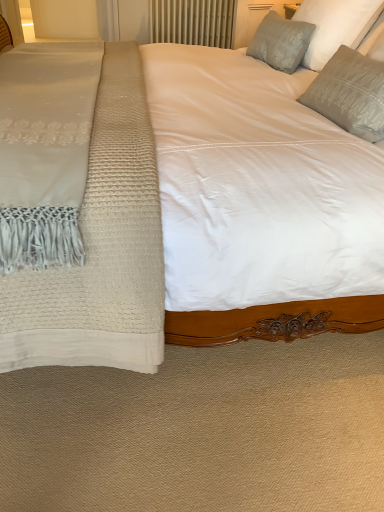
Identify the location of gray textured pillow at upper right, the second pillow from the front. (x=333, y=26).

Find the location of a particular element. The width and height of the screenshot is (384, 512). satin gray pillow at upper right, the first pillow viewed from the front is located at coordinates (350, 94).

Describe the element at coordinates (193, 22) in the screenshot. I see `metallic radiator at upper center` at that location.

Image resolution: width=384 pixels, height=512 pixels. What do you see at coordinates (65, 19) in the screenshot? I see `transparent glass door at upper left` at bounding box center [65, 19].

Where is `gray textured pillow at upper right, the second pillow from the front`? gray textured pillow at upper right, the second pillow from the front is located at coordinates (333, 26).

Does satin gray pillow at upper right, the first pillow viewed from the front, lie behind metallic radiator at upper center?

No, it is not.

Looking at this image, from a real-world perspective, is satin gray pillow at upper right, the first pillow viewed from the front, positioned over metallic radiator at upper center based on gravity?

Yes, from a real-world perspective, satin gray pillow at upper right, the first pillow viewed from the front, is over metallic radiator at upper center

Do you think satin gray pillow at upper right, the first pillow viewed from the front, is within metallic radiator at upper center, or outside of it?

satin gray pillow at upper right, the first pillow viewed from the front, exists outside the volume of metallic radiator at upper center.

What's the angular difference between satin gray pillow at upper right, acting as the 3th pillow starting from the back, and metallic radiator at upper center's facing directions?

The angular difference between satin gray pillow at upper right, acting as the 3th pillow starting from the back, and metallic radiator at upper center is 86.5 degrees.

Is satin gray pillow at upper right, the first pillow viewed from the front, at the right side of gray textured pillow at upper right, positioned as the 2th pillow in back-to-front order?

No.

Is satin gray pillow at upper right, the first pillow viewed from the front, looking in the opposite direction of gray textured pillow at upper right, the second pillow from the front?

Absolutely, satin gray pillow at upper right, the first pillow viewed from the front, is directed away from gray textured pillow at upper right, the second pillow from the front.

Based on the photo, is satin gray pillow at upper right, acting as the 3th pillow starting from the back, touching gray textured pillow at upper right, positioned as the 2th pillow in back-to-front order?

No.

Looking at their sizes, would you say satin gray pillow at upper right, the first pillow viewed from the front, is wider or thinner than gray textured pillow at upper right, the second pillow from the front?

satin gray pillow at upper right, the first pillow viewed from the front, is thinner than gray textured pillow at upper right, the second pillow from the front.

How far apart are metallic radiator at upper center and transparent glass door at upper left?

metallic radiator at upper center is 1.70 meters from transparent glass door at upper left.

Considering the sizes of metallic radiator at upper center and transparent glass door at upper left in the image, is metallic radiator at upper center wider or thinner than transparent glass door at upper left?

Considering their sizes, metallic radiator at upper center looks slimmer than transparent glass door at upper left.

Is the depth of metallic radiator at upper center greater than that of transparent glass door at upper left?

No, metallic radiator at upper center is closer to the viewer.

From a real-world perspective, which object rests below the other?

From a 3D spatial view, transparent glass door at upper left is below.

Does point (300, 41) lie behind point (366, 139)?

Yes, point (300, 41) is farther from viewer.

Considering the relative sizes of satin gray pillow at upper right, the 1th pillow when ordered from back to front, and satin gray pillow at upper right, the first pillow viewed from the front, in the image provided, is satin gray pillow at upper right, the 1th pillow when ordered from back to front, thinner than satin gray pillow at upper right, the first pillow viewed from the front,?

Yes.

Is satin gray pillow at upper right, which is the third pillow in front-to-back order, to the left or to the right of satin gray pillow at upper right, acting as the 3th pillow starting from the back, in the image?

satin gray pillow at upper right, which is the third pillow in front-to-back order, is positioned on satin gray pillow at upper right, acting as the 3th pillow starting from the back,'s left side.

Which is behind, point (252, 52) or point (152, 14)?

Point (152, 14)

Is metallic radiator at upper center surrounded by satin gray pillow at upper right, the 1th pillow when ordered from back to front?

That's incorrect, metallic radiator at upper center is not inside satin gray pillow at upper right, the 1th pillow when ordered from back to front.

From the picture: Can you tell me how much satin gray pillow at upper right, which is the third pillow in front-to-back order, and metallic radiator at upper center differ in facing direction?

The facing directions of satin gray pillow at upper right, which is the third pillow in front-to-back order, and metallic radiator at upper center are 90.3 degrees apart.

Is satin gray pillow at upper right, the first pillow viewed from the front, located outside transparent glass door at upper left?

satin gray pillow at upper right, the first pillow viewed from the front, lies outside transparent glass door at upper left's area.

From a real-world perspective, is satin gray pillow at upper right, the first pillow viewed from the front, on transparent glass door at upper left?

Yes.

Can you confirm if satin gray pillow at upper right, the first pillow viewed from the front, is taller than transparent glass door at upper left?

No, satin gray pillow at upper right, the first pillow viewed from the front, is not taller than transparent glass door at upper left.

Is point (362, 68) closer or farther from the camera than point (45, 14)?

Point (362, 68).

Relative to satin gray pillow at upper right, which is the third pillow in front-to-back order, is satin gray pillow at upper right, the first pillow viewed from the front, in front or behind?

satin gray pillow at upper right, the first pillow viewed from the front, is in front of satin gray pillow at upper right, which is the third pillow in front-to-back order.

From a real-world perspective, who is located higher, satin gray pillow at upper right, acting as the 3th pillow starting from the back, or satin gray pillow at upper right, which is the third pillow in front-to-back order?

satin gray pillow at upper right, which is the third pillow in front-to-back order, from a real-world perspective.

Based on their positions, is satin gray pillow at upper right, acting as the 3th pillow starting from the back, located to the left or right of satin gray pillow at upper right, the 1th pillow when ordered from back to front?

satin gray pillow at upper right, acting as the 3th pillow starting from the back, is to the right of satin gray pillow at upper right, the 1th pillow when ordered from back to front.

From the image's perspective, which is above, satin gray pillow at upper right, acting as the 3th pillow starting from the back, or satin gray pillow at upper right, the 1th pillow when ordered from back to front?

satin gray pillow at upper right, the 1th pillow when ordered from back to front, appears higher in the image.

This screenshot has width=384, height=512. What are the coordinates of `the 1st pillow above the metallic radiator at upper center (from a real-world perspective)` in the screenshot? It's located at (350, 94).

From the image's perspective, which pillow is the 1st one above the satin gray pillow at upper right, acting as the 3th pillow starting from the back? Please provide its 2D coordinates.

[(333, 26)]

Based on their spatial positions, is satin gray pillow at upper right, which is the third pillow in front-to-back order, or transparent glass door at upper left further from satin gray pillow at upper right, the first pillow viewed from the front?

The object further to satin gray pillow at upper right, the first pillow viewed from the front, is transparent glass door at upper left.

Based on their spatial positions, is gray textured pillow at upper right, the second pillow from the front, or metallic radiator at upper center further from satin gray pillow at upper right, acting as the 3th pillow starting from the back?

metallic radiator at upper center is positioned further to the anchor satin gray pillow at upper right, acting as the 3th pillow starting from the back.

Looking at this image, when comparing their distances from satin gray pillow at upper right, which is the third pillow in front-to-back order, does satin gray pillow at upper right, acting as the 3th pillow starting from the back, or metallic radiator at upper center seem closer?

Among the two, satin gray pillow at upper right, acting as the 3th pillow starting from the back, is located nearer to satin gray pillow at upper right, which is the third pillow in front-to-back order.

From the image, which object appears to be nearer to transparent glass door at upper left, satin gray pillow at upper right, the 1th pillow when ordered from back to front, or metallic radiator at upper center?

satin gray pillow at upper right, the 1th pillow when ordered from back to front.

Considering their positions, is metallic radiator at upper center positioned further to transparent glass door at upper left than satin gray pillow at upper right, acting as the 3th pillow starting from the back?

metallic radiator at upper center is further to transparent glass door at upper left.

Based on their spatial positions, is satin gray pillow at upper right, the first pillow viewed from the front, or satin gray pillow at upper right, the 1th pillow when ordered from back to front, closer to transparent glass door at upper left?

satin gray pillow at upper right, the 1th pillow when ordered from back to front.

From the image, which object appears to be farther from metallic radiator at upper center, satin gray pillow at upper right, the first pillow viewed from the front, or satin gray pillow at upper right, the 1th pillow when ordered from back to front?

satin gray pillow at upper right, the first pillow viewed from the front, lies further to metallic radiator at upper center than the other object.

Looking at the image, which one is located further to metallic radiator at upper center, satin gray pillow at upper right, acting as the 3th pillow starting from the back, or gray textured pillow at upper right, the second pillow from the front?

satin gray pillow at upper right, acting as the 3th pillow starting from the back.

The height and width of the screenshot is (512, 384). What are the coordinates of `radiator between satin gray pillow at upper right, acting as the 3th pillow starting from the back, and transparent glass door at upper left from front to back` in the screenshot? It's located at (193, 22).

Image resolution: width=384 pixels, height=512 pixels. Identify the location of radiator between satin gray pillow at upper right, the 1th pillow when ordered from back to front, and transparent glass door at upper left, along the z-axis. (193, 22).

Find the location of a particular element. pillow between gray textured pillow at upper right, positioned as the 2th pillow in back-to-front order, and metallic radiator at upper center from front to back is located at coordinates (281, 42).

Identify the location of radiator between gray textured pillow at upper right, the second pillow from the front, and transparent glass door at upper left in the front-back direction. This screenshot has width=384, height=512. (193, 22).